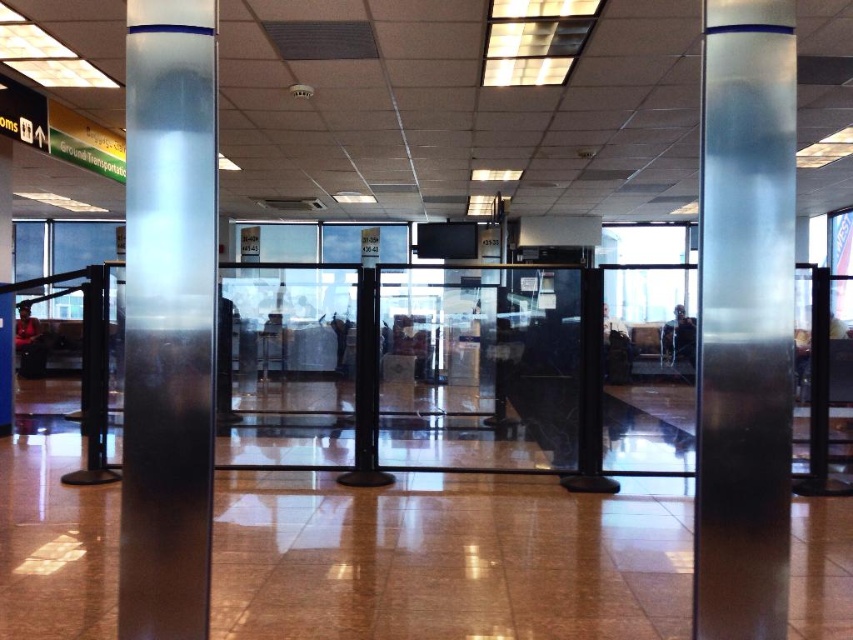
You are standing in the airport terminal and see the satin silver column at center and the satin silver pole at center. Which object is nearer to you?

The satin silver column at center is closer to the viewer than the satin silver pole at center.

You are a maintenance worker needing to reach the camera with a ladder. The ladder you have is 2 meters long. Considering the distance between the satin silver column at center and the camera, can you safely reach the camera without moving the column?

The distance between the satin silver column at center and the camera is 2.20 meters. Since the ladder is only 2 meters long, it is 20 centimeters shorter than needed. Therefore, you cannot safely reach the camera without moving the column.